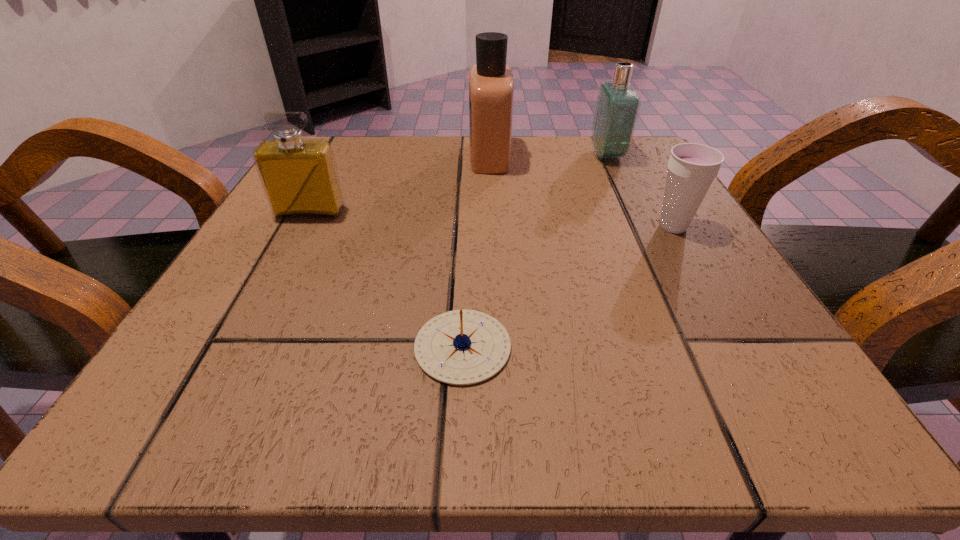
The width and height of the screenshot is (960, 540). I want to click on the tallest object, so click(x=491, y=88).

In order to click on the tallest perfume in this screenshot , I will do `click(491, 88)`.

This screenshot has width=960, height=540. I want to click on the rightmost perfume, so click(617, 107).

Locate an element on the screen. Image resolution: width=960 pixels, height=540 pixels. the leftmost object is located at coordinates (300, 179).

At what (x,y) coordinates should I click in order to perform the action: click on the nearest perfume. Please return your answer as a coordinate pair (x, y). The image size is (960, 540). Looking at the image, I should click on (300, 179).

Find the location of a particular element. The image size is (960, 540). cup is located at coordinates (692, 167).

Where is `compass`? This screenshot has width=960, height=540. compass is located at coordinates (461, 347).

Identify the location of the nearest object. tap(461, 347).

Locate an element on the screen. The height and width of the screenshot is (540, 960). vacant area situated 0.110m on the front label of the tallest object is located at coordinates (418, 156).

This screenshot has width=960, height=540. I want to click on vacant space situated 0.220m on the front label of the tallest object, so click(365, 156).